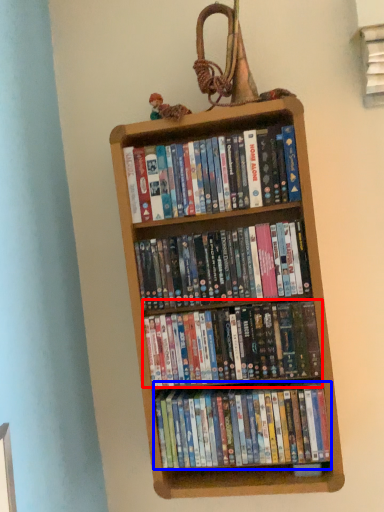
Question: Which object appears farthest to the camera in this image, book (highlighted by a red box) or book (highlighted by a blue box)?

Choices:
 (A) book
 (B) book

Answer: (B)